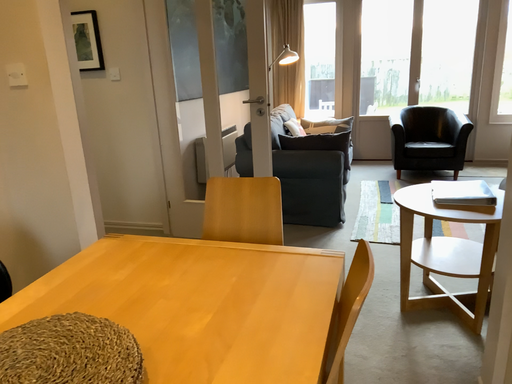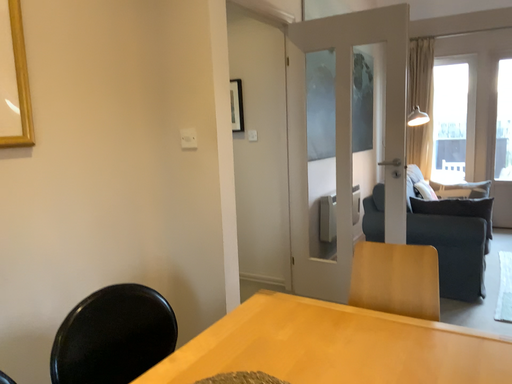
Question: Which way did the camera rotate in the video?

Choices:
 (A) rotated downward
 (B) rotated upward

Answer: (B)